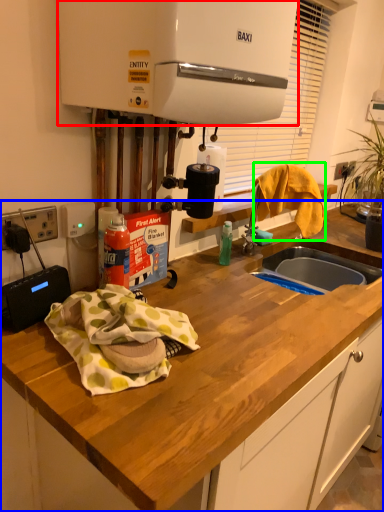
Question: Based on their relative distances, which object is farther from home appliance (highlighted by a red box)? Choose from countertop (highlighted by a blue box) and clothe (highlighted by a green box).

Choices:
 (A) countertop
 (B) clothe

Answer: (A)